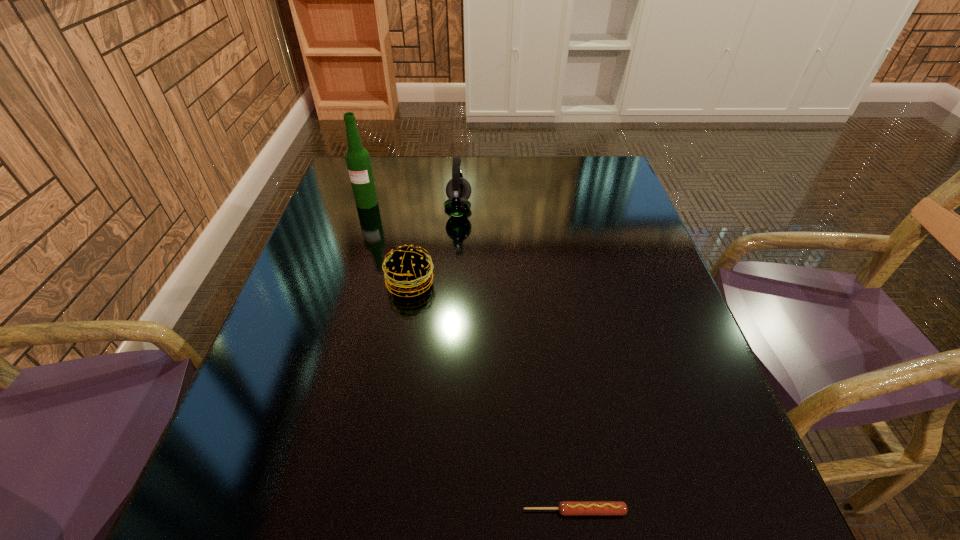
Identify the location of free point that satisfies the following two spatial constraints: 1. on the back side of the rightmost object; 2. on the ear cups of the third object from left to right. The image size is (960, 540). (532, 209).